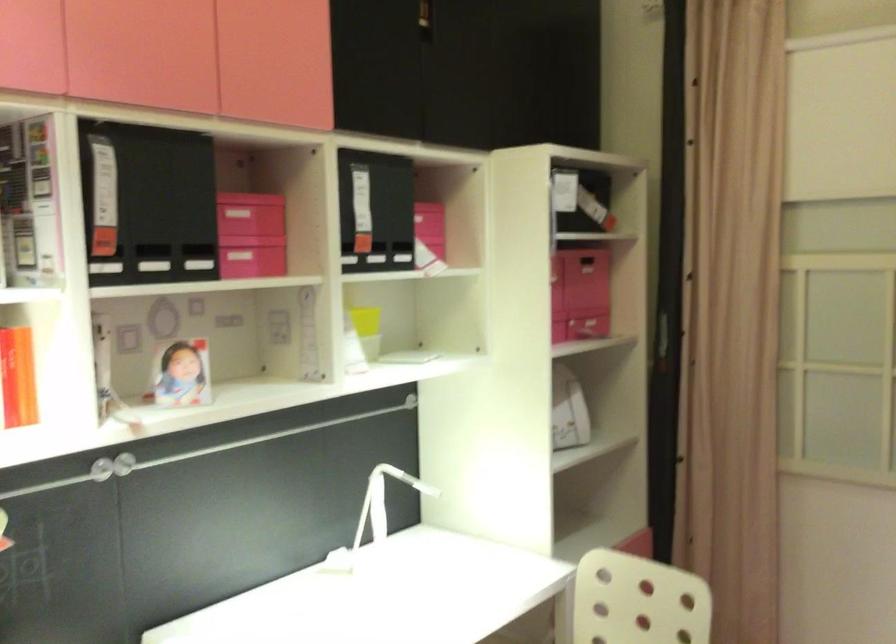
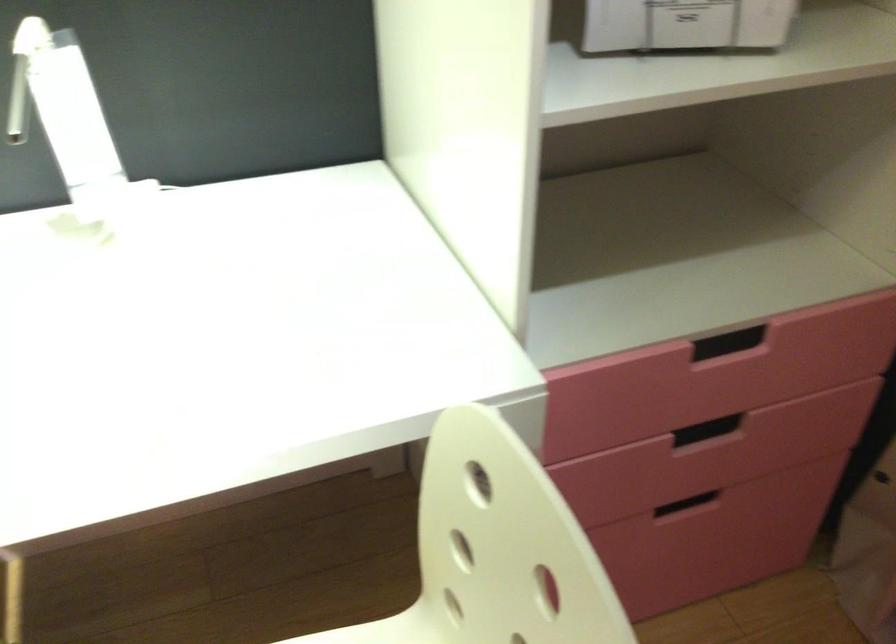
Where in the second image is the point corresponding to point 566,438 from the first image?

(685, 24)